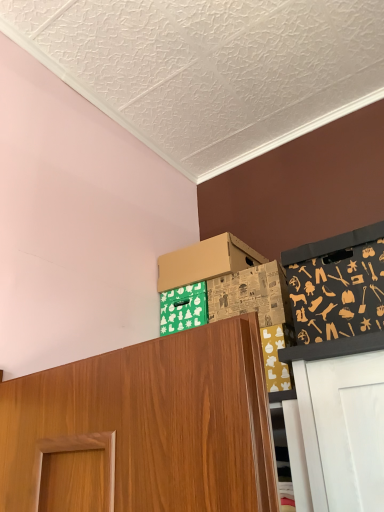
What do you see at coordinates (337, 285) in the screenshot?
I see `black fabric with tool patterns at upper right` at bounding box center [337, 285].

Find the location of a particular element. The image size is (384, 512). black fabric with tool patterns at upper right is located at coordinates (337, 285).

Between brown cardboard box at upper center, which ranks as the 2th box in front-to-back order, and black fabric with tool patterns at upper right, which one has less height?

brown cardboard box at upper center, which ranks as the 2th box in front-to-back order, is shorter.

How many degrees apart are the facing directions of brown cardboard box at upper center, which ranks as the 2th box in front-to-back order, and black fabric with tool patterns at upper right?

7.82e-05 degrees separate the facing orientations of brown cardboard box at upper center, which ranks as the 2th box in front-to-back order, and black fabric with tool patterns at upper right.

Considering the positions of objects brown cardboard box at upper center, arranged as the 1th box when viewed from the back, and black fabric with tool patterns at upper right in the image provided, who is in front, brown cardboard box at upper center, arranged as the 1th box when viewed from the back, or black fabric with tool patterns at upper right?

black fabric with tool patterns at upper right.

From a real-world perspective, between brown cardboard box at upper center, which ranks as the 2th box in front-to-back order, and black fabric with tool patterns at upper right, who is vertically lower?

black fabric with tool patterns at upper right is physically lower.

Is cardboard box at upper center, which is counted as the second box, starting from the back, not close to black fabric with tool patterns at upper right?

That's not correct — cardboard box at upper center, which is counted as the second box, starting from the back, is a little close to black fabric with tool patterns at upper right.

Does cardboard box at upper center, which is counted as the second box, starting from the back, appear on the right side of black fabric with tool patterns at upper right?

No.

From the image's perspective, does cardboard box at upper center, which is counted as the second box, starting from the back, appear higher than black fabric with tool patterns at upper right?

No, from the image's perspective, cardboard box at upper center, which is counted as the second box, starting from the back, is not on top of black fabric with tool patterns at upper right.

Does point (241, 298) lie in front of point (383, 263)?

No, it is behind (383, 263).

From the image's perspective, which object appears higher, cardboard box at upper center, which is counted as the second box, starting from the back, or brown cardboard box at upper center, which ranks as the 2th box in front-to-back order?

brown cardboard box at upper center, which ranks as the 2th box in front-to-back order, is shown above in the image.

Image resolution: width=384 pixels, height=512 pixels. Find the location of `box that is on the left side of cardboard box at upper center, the first box when ordered from front to back`. box that is on the left side of cardboard box at upper center, the first box when ordered from front to back is located at coordinates (205, 261).

Does cardboard box at upper center, the first box when ordered from front to back, turn towards brown cardboard box at upper center, arranged as the 1th box when viewed from the back?

No, cardboard box at upper center, the first box when ordered from front to back, is not facing towards brown cardboard box at upper center, arranged as the 1th box when viewed from the back.

From their relative heights in the image, would you say cardboard box at upper center, which is counted as the second box, starting from the back, is taller or shorter than brown cardboard box at upper center, which ranks as the 2th box in front-to-back order?

cardboard box at upper center, which is counted as the second box, starting from the back, is taller than brown cardboard box at upper center, which ranks as the 2th box in front-to-back order.

Is black fabric with tool patterns at upper right far from cardboard box at upper center, which is counted as the second box, starting from the back?

black fabric with tool patterns at upper right is near cardboard box at upper center, which is counted as the second box, starting from the back, not far away.

Considering the positions of point (288, 256) and point (215, 293), is point (288, 256) closer or farther from the camera than point (215, 293)?

Clearly, point (288, 256) is closer to the camera than point (215, 293).

Consider the image. Is black fabric with tool patterns at upper right bigger or smaller than cardboard box at upper center, which is counted as the second box, starting from the back?

Clearly, black fabric with tool patterns at upper right is larger in size than cardboard box at upper center, which is counted as the second box, starting from the back.

From the picture: Is black fabric with tool patterns at upper right in contact with brown cardboard box at upper center, arranged as the 1th box when viewed from the back?

No, black fabric with tool patterns at upper right is not touching brown cardboard box at upper center, arranged as the 1th box when viewed from the back.

From a real-world perspective, is black fabric with tool patterns at upper right over brown cardboard box at upper center, which ranks as the 2th box in front-to-back order?

Incorrect, from a real-world perspective, black fabric with tool patterns at upper right is lower than brown cardboard box at upper center, which ranks as the 2th box in front-to-back order.

From the picture: Is black fabric with tool patterns at upper right taller or shorter than brown cardboard box at upper center, arranged as the 1th box when viewed from the back?

In the image, black fabric with tool patterns at upper right appears to be taller than brown cardboard box at upper center, arranged as the 1th box when viewed from the back.

How far apart are black fabric with tool patterns at upper right and brown cardboard box at upper center, which ranks as the 2th box in front-to-back order?

black fabric with tool patterns at upper right is 49.02 centimeters from brown cardboard box at upper center, which ranks as the 2th box in front-to-back order.

Between brown cardboard box at upper center, which ranks as the 2th box in front-to-back order, and cardboard box at upper center, the first box when ordered from front to back, which one has larger size?

With larger size is brown cardboard box at upper center, which ranks as the 2th box in front-to-back order.

How much distance is there between brown cardboard box at upper center, which ranks as the 2th box in front-to-back order, and cardboard box at upper center, the first box when ordered from front to back?

The distance of brown cardboard box at upper center, which ranks as the 2th box in front-to-back order, from cardboard box at upper center, the first box when ordered from front to back, is 5.74 inches.

Which is in front, brown cardboard box at upper center, which ranks as the 2th box in front-to-back order, or cardboard box at upper center, the first box when ordered from front to back?

cardboard box at upper center, the first box when ordered from front to back, is closer to the camera.

You are a GUI agent. You are given a task and a screenshot of the screen. Output one action in this format:
    pyautogui.click(x=<x>, y=<y>)
    Task: Click on the 2nd box to the left when counting from the black fabric with tool patterns at upper right
    
    Given the screenshot: What is the action you would take?
    pyautogui.click(x=205, y=261)

What are the coordinates of `box that is the 1st one when counting backward from the black fabric with tool patterns at upper right` in the screenshot? It's located at (251, 295).

From the image, which object appears to be farther from cardboard box at upper center, which is counted as the second box, starting from the back, black fabric with tool patterns at upper right or brown cardboard box at upper center, which ranks as the 2th box in front-to-back order?

black fabric with tool patterns at upper right lies further to cardboard box at upper center, which is counted as the second box, starting from the back, than the other object.

From the image, which object appears to be farther from black fabric with tool patterns at upper right, brown cardboard box at upper center, arranged as the 1th box when viewed from the back, or cardboard box at upper center, which is counted as the second box, starting from the back?

brown cardboard box at upper center, arranged as the 1th box when viewed from the back, is positioned further to the anchor black fabric with tool patterns at upper right.

Which object lies further to the anchor point brown cardboard box at upper center, arranged as the 1th box when viewed from the back, black fabric with tool patterns at upper right or cardboard box at upper center, which is counted as the second box, starting from the back?

black fabric with tool patterns at upper right is further to brown cardboard box at upper center, arranged as the 1th box when viewed from the back.

In the scene shown: Based on their spatial positions, is cardboard box at upper center, the first box when ordered from front to back, or black fabric with tool patterns at upper right further from brown cardboard box at upper center, arranged as the 1th box when viewed from the back?

black fabric with tool patterns at upper right lies further to brown cardboard box at upper center, arranged as the 1th box when viewed from the back, than the other object.

Based on the photo, estimate the real-world distances between objects in this image. Which object is further from cardboard box at upper center, which is counted as the second box, starting from the back, brown cardboard box at upper center, arranged as the 1th box when viewed from the back, or black fabric with tool patterns at upper right?

black fabric with tool patterns at upper right lies further to cardboard box at upper center, which is counted as the second box, starting from the back, than the other object.

Looking at the image, which one is located further to black fabric with tool patterns at upper right, cardboard box at upper center, the first box when ordered from front to back, or brown cardboard box at upper center, arranged as the 1th box when viewed from the back?

brown cardboard box at upper center, arranged as the 1th box when viewed from the back, lies further to black fabric with tool patterns at upper right than the other object.

Where is `box positioned between black fabric with tool patterns at upper right and brown cardboard box at upper center, arranged as the 1th box when viewed from the back, from near to far`? The height and width of the screenshot is (512, 384). box positioned between black fabric with tool patterns at upper right and brown cardboard box at upper center, arranged as the 1th box when viewed from the back, from near to far is located at coordinates click(251, 295).